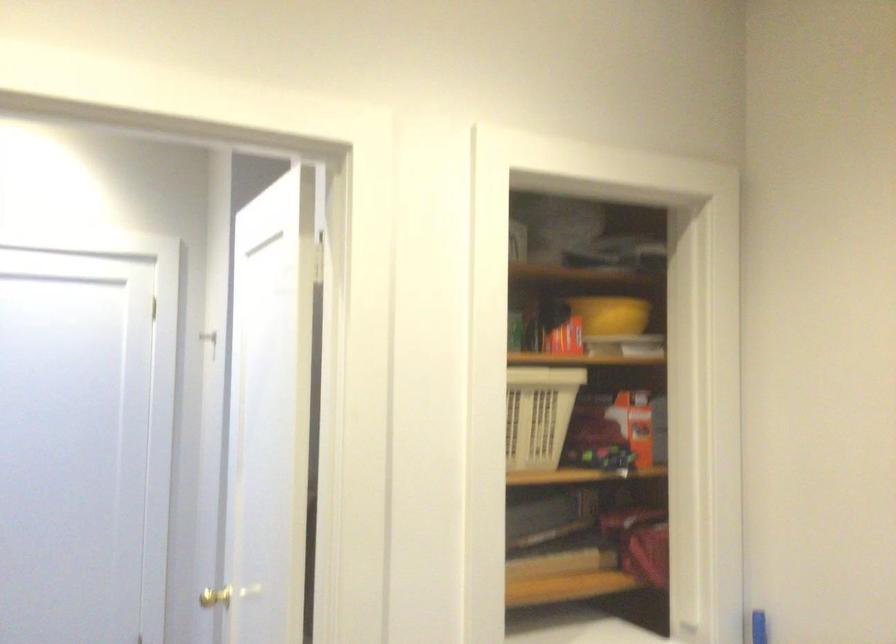
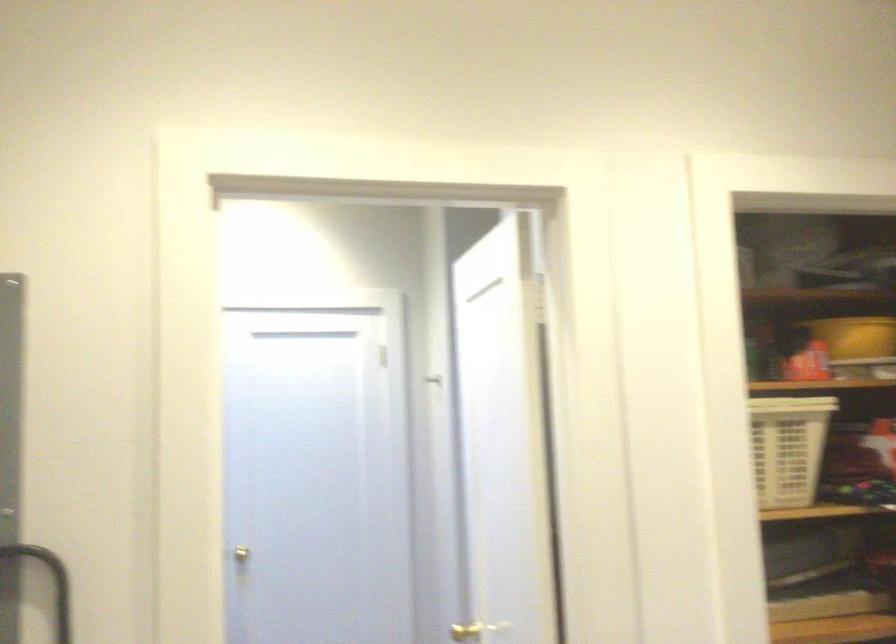
Question: The camera is either moving clockwise (left) or counter-clockwise (right) around the object. The first image is from the beginning of the video and the second image is from the end. Is the camera moving left or right when shooting the video?

Choices:
 (A) Left
 (B) Right

Answer: (B)